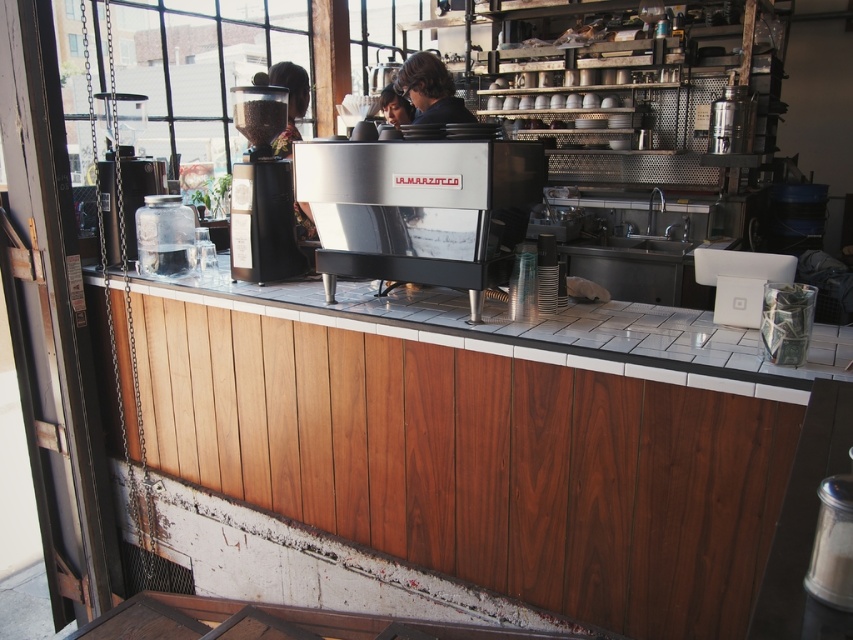
You are a barista who needs to reach the espresso machine. You notice the matte black espresso machine at center and the transparent glass window at upper left. Which object is closer to the floor?

The matte black espresso machine at center is shorter than the transparent glass window at upper left, so the espresso machine is closer to the floor.

You are a barista working at the coffee shop. You need to place a new coffee bean container between the matte black espresso machine at center and the transparent glass window at upper left. Considering their positions, where should you place it so it doesn

The matte black espresso machine at center is in front of the transparent glass window at upper left, so you should place the new coffee bean container between them by positioning it in front of the espresso machine and closer to the window to ensure it is visible from both areas.

You are a barista working behind the counter in the coffee shop. You need to place a small cup at the point labeled point (697, 326) and another small cup at point (399, 112). Which cup will be closer to the customers standing in front of the counter?

The cup placed at point (697, 326) will be closer to the customers because it is in front of point (399, 112).